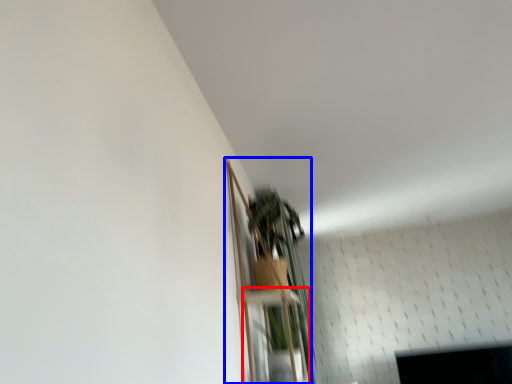
Question: Which of the following is the farthest to the observer, shelf (highlighted by a red box) or shelf (highlighted by a blue box)?

Choices:
 (A) shelf
 (B) shelf

Answer: (A)